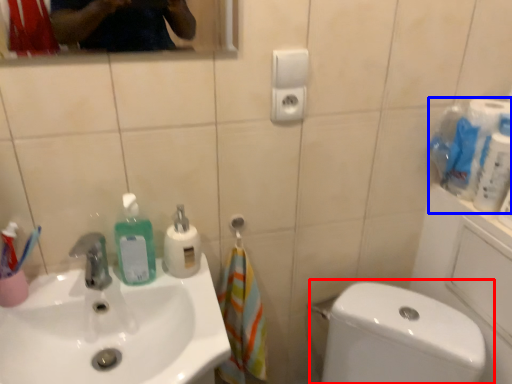
Question: Among these objects, which one is farthest to the camera, toilet (highlighted by a red box) or toilet paper (highlighted by a blue box)?

Choices:
 (A) toilet
 (B) toilet paper

Answer: (B)